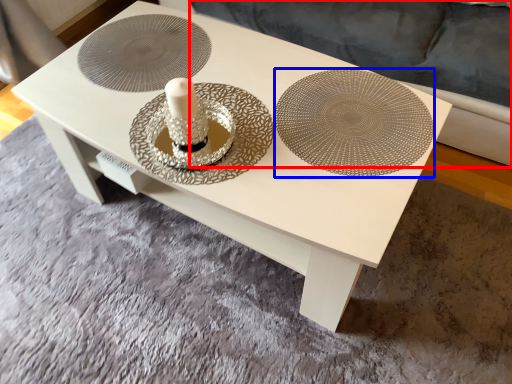
Question: Which point is closer to the camera, couch (highlighted by a red box) or plate (highlighted by a blue box)?

Choices:
 (A) couch
 (B) plate

Answer: (B)